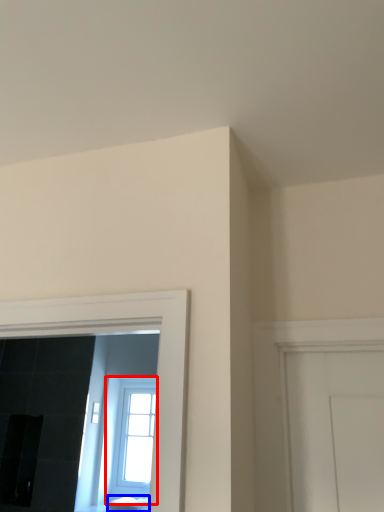
Question: Which of the following is the closest to the observer, window (highlighted by a red box) or furniture (highlighted by a blue box)?

Choices:
 (A) window
 (B) furniture

Answer: (B)